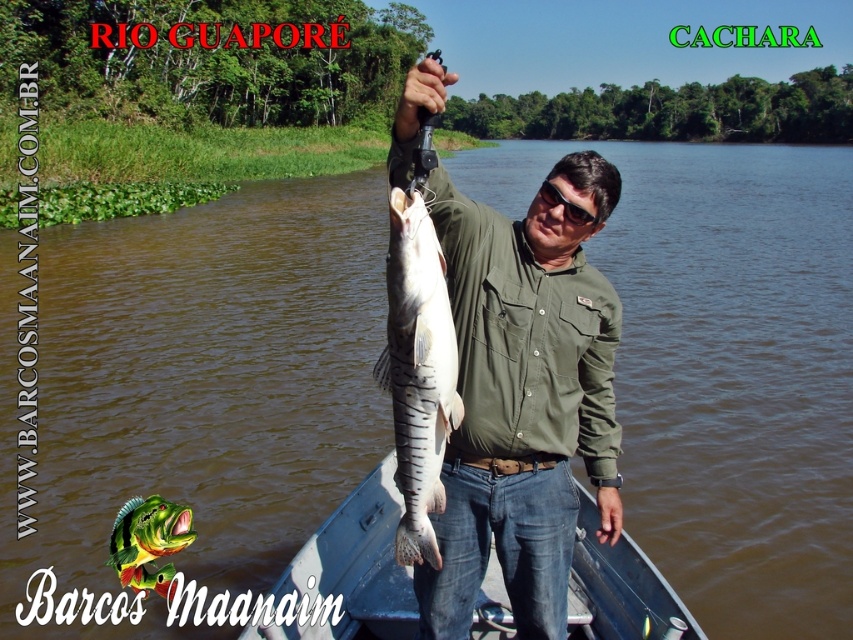
Question: Does white striped fish at center appear on the right side of shiny green fish at center?

Choices:
 (A) no
 (B) yes

Answer: (B)

Question: Which point is farther from the camera taking this photo?

Choices:
 (A) (361, 621)
 (B) (432, 502)

Answer: (A)

Question: Can you confirm if green matte shirt at center is positioned to the right of shiny green fish at center?

Choices:
 (A) no
 (B) yes

Answer: (B)

Question: From the image, what is the correct spatial relationship of blue plastic boat at center in relation to white striped fish at center?

Choices:
 (A) below
 (B) above

Answer: (A)

Question: Considering the real-world distances, which object is closest to the blue plastic boat at center?

Choices:
 (A) white striped fish at center
 (B) shiny green fish at center
 (C) green matte shirt at center

Answer: (B)

Question: Which point is closer to the camera taking this photo?

Choices:
 (A) (614, 563)
 (B) (532, 483)
 (C) (138, 515)
 (D) (447, 429)

Answer: (D)